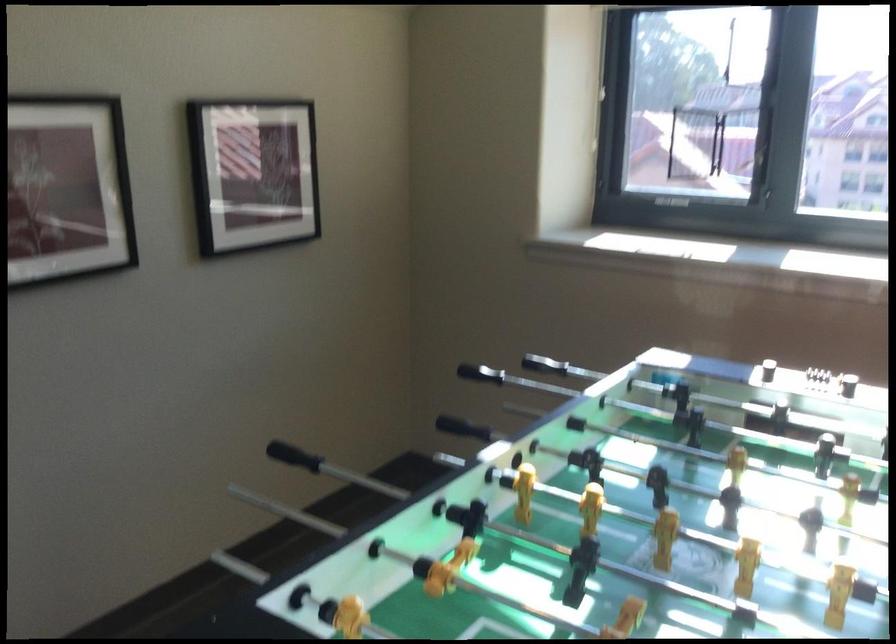
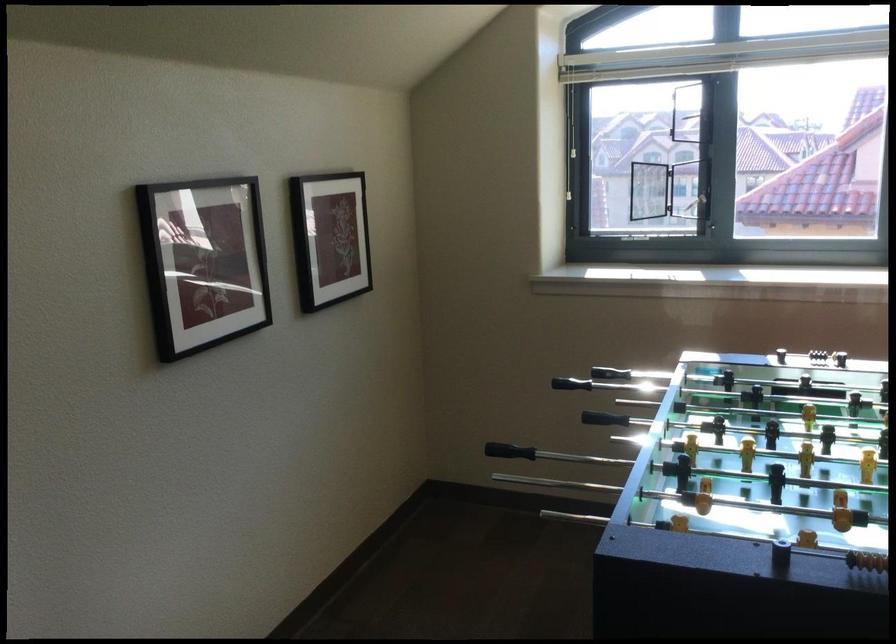
Locate, in the second image, the point that corresponds to point 254,180 in the first image.

(330, 238)